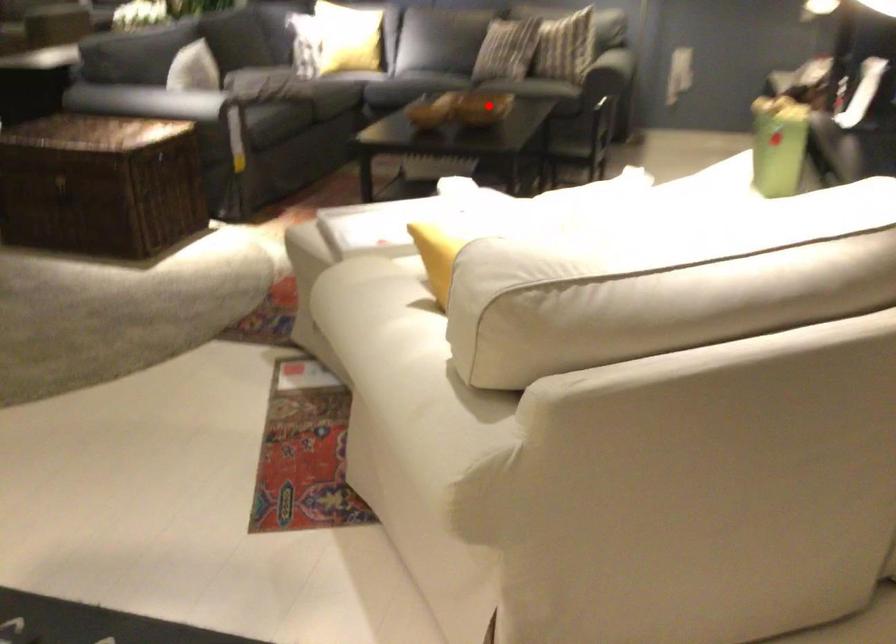
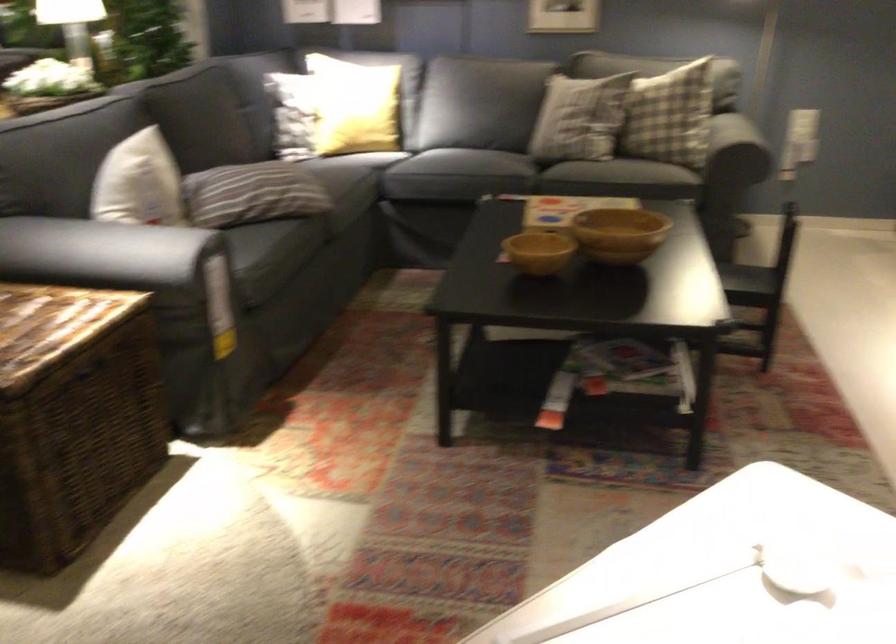
Question: A red point is marked in image1. In image2, is the corresponding 3D point closer to the camera or farther? Reply with the corresponding letter.

Choices:
 (A) The corresponding 3D point is closer.
 (B) The corresponding 3D point is farther.

Answer: (A)